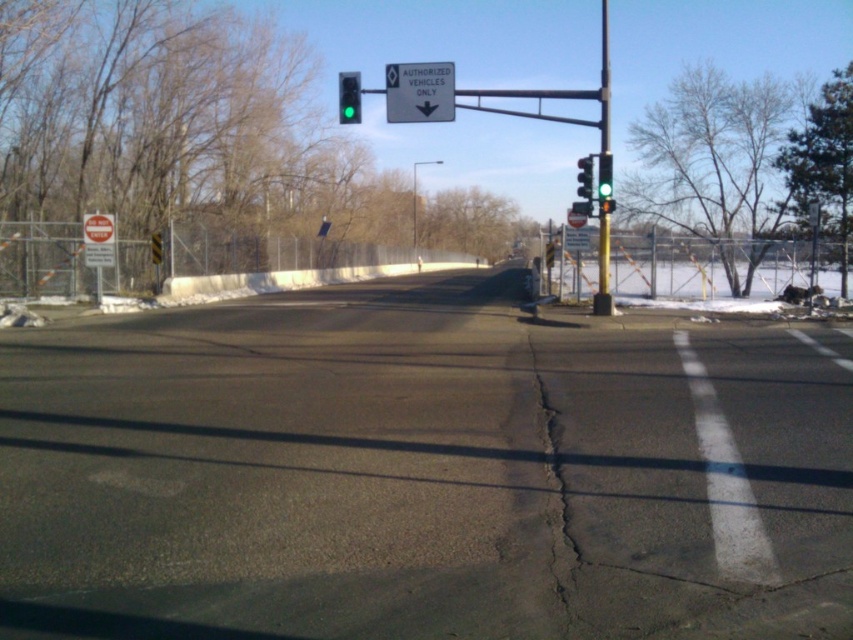
Question: Does green glass traffic light at upper center have a lesser width compared to green glass traffic light at upper right?

Choices:
 (A) yes
 (B) no

Answer: (B)

Question: Can you confirm if gray asphalt crack at lower right is thinner than white plastic sign at upper center?

Choices:
 (A) yes
 (B) no

Answer: (A)

Question: Which of the following is the closest to the observer?

Choices:
 (A) click(561, 422)
 (B) click(581, 166)
 (C) click(605, 193)
 (D) click(395, 122)

Answer: (A)

Question: Does white plastic sign at left appear over green glass traffic light at upper right?

Choices:
 (A) yes
 (B) no

Answer: (B)

Question: Which point is closer to the camera taking this photo?

Choices:
 (A) (347, 88)
 (B) (605, 253)
 (C) (566, 493)

Answer: (C)

Question: Among these points, which one is nearest to the camera?

Choices:
 (A) [x=341, y=97]
 (B) [x=566, y=588]

Answer: (B)